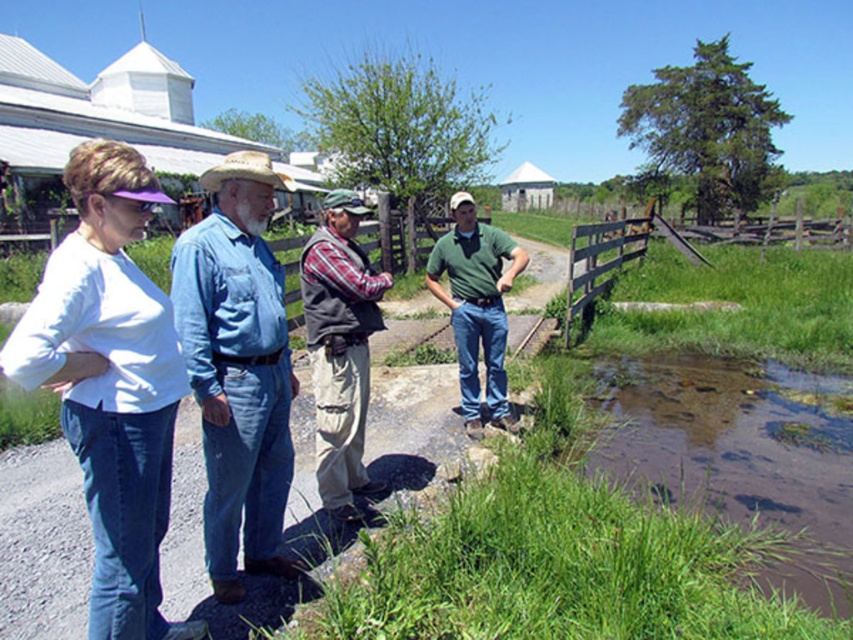
Can you confirm if plaid shirt vest at center is taller than brown wooden fence at right?

In fact, plaid shirt vest at center may be shorter than brown wooden fence at right.

Is point (339, 512) farther from camera compared to point (577, 228)?

No, it is not.

Who is more distant from viewer, (x=302, y=262) or (x=572, y=227)?

Positioned behind is point (x=572, y=227).

Locate an element on the screen. This screenshot has height=640, width=853. plaid shirt vest at center is located at coordinates (340, 348).

Which of these two, green matte shirt at center or light brown straw cowboy hat at center, stands taller?

light brown straw cowboy hat at center is taller.

What do you see at coordinates (476, 305) in the screenshot?
I see `green matte shirt at center` at bounding box center [476, 305].

Where is `green matte shirt at center`? This screenshot has width=853, height=640. green matte shirt at center is located at coordinates (476, 305).

This screenshot has width=853, height=640. What do you see at coordinates (109, 381) in the screenshot? I see `white matte shirt at left` at bounding box center [109, 381].

Can you confirm if white matte shirt at left is positioned to the left of denim shirt at left?

Correct, you'll find white matte shirt at left to the left of denim shirt at left.

Find the location of a particular element. This screenshot has height=640, width=853. white matte shirt at left is located at coordinates (109, 381).

The width and height of the screenshot is (853, 640). I want to click on white matte shirt at left, so click(109, 381).